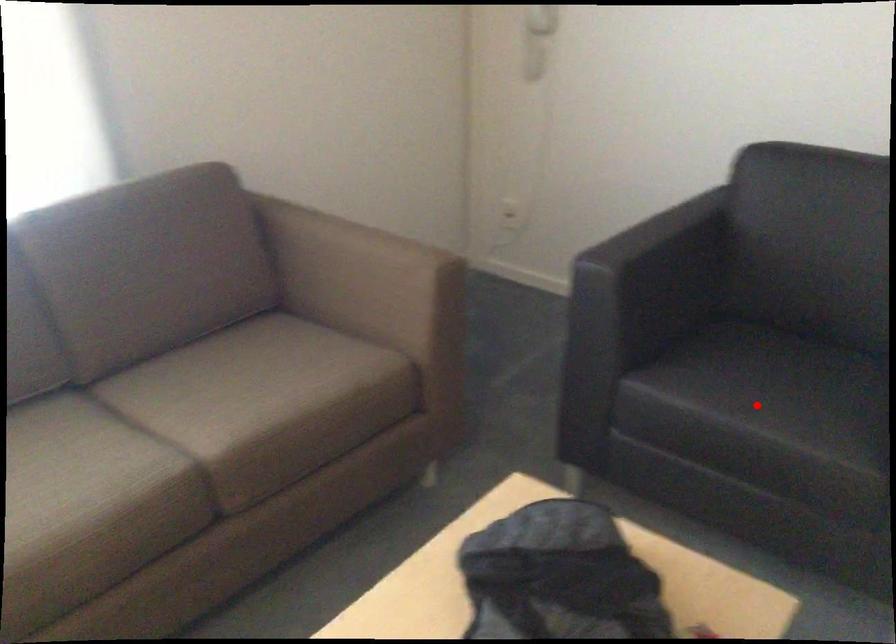
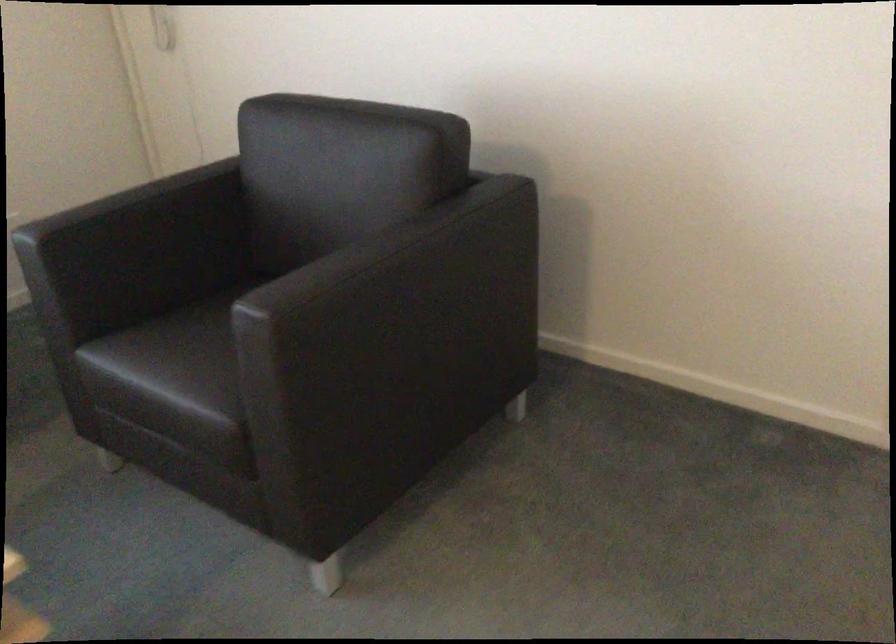
Find the pixel in the second image that matches the highlighted location in the first image.

(168, 366)